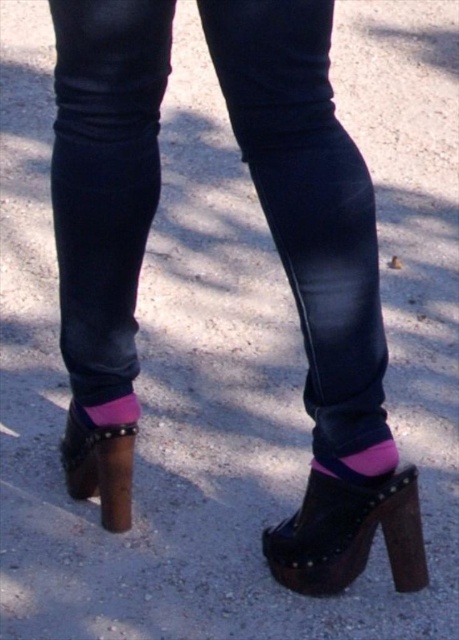
Who is positioned more to the left, black leather platform shoe at lower center or pink fabric sock at lower center?

Positioned to the left is pink fabric sock at lower center.

Does black leather platform shoe at lower center appear on the right side of pink fabric sock at lower center?

Indeed, black leather platform shoe at lower center is positioned on the right side of pink fabric sock at lower center.

This screenshot has width=459, height=640. Find the location of `black leather platform shoe at lower center`. black leather platform shoe at lower center is located at coordinates (348, 532).

Does dark blue denim jeans at center have a larger size compared to leather platform sandal at lower left?

Yes.

The width and height of the screenshot is (459, 640). Find the location of `dark blue denim jeans at center`. dark blue denim jeans at center is located at coordinates (308, 202).

Can you confirm if black leather platform shoe at lower center is positioned below leather platform sandal at lower left?

Correct, black leather platform shoe at lower center is located below leather platform sandal at lower left.

Can you confirm if black leather platform shoe at lower center is taller than leather platform sandal at lower left?

Yes, black leather platform shoe at lower center is taller than leather platform sandal at lower left.

Is point (403, 467) in front of point (119, 436)?

Yes, point (403, 467) is closer to viewer.

The height and width of the screenshot is (640, 459). I want to click on black leather platform shoe at lower center, so click(x=348, y=532).